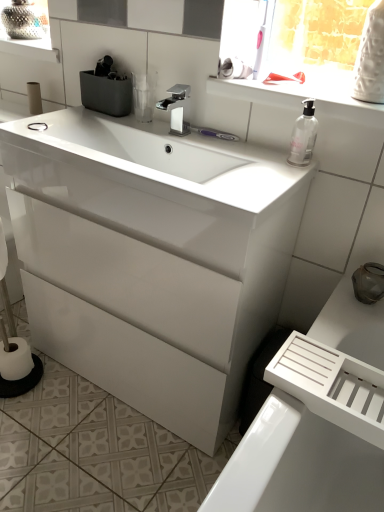
This screenshot has width=384, height=512. What are the coordinates of `free location to the right of polished chrome faucet at center` in the screenshot? It's located at (221, 145).